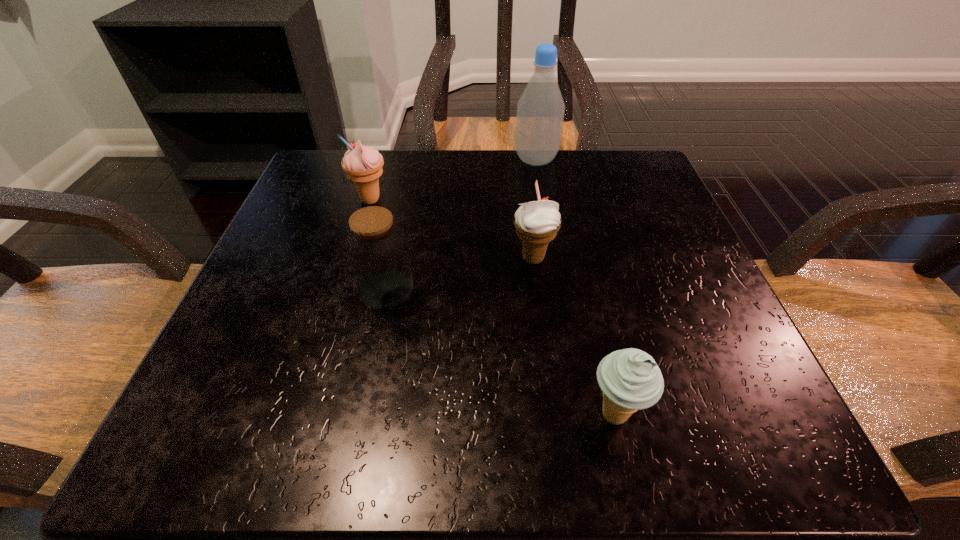
This screenshot has height=540, width=960. I want to click on the farthest object, so click(540, 110).

At what (x,y) coordinates should I click in order to perform the action: click on bottle. Please return your answer as a coordinate pair (x, y). The width and height of the screenshot is (960, 540). Looking at the image, I should click on (540, 110).

At what (x,y) coordinates should I click in order to perform the action: click on the second farthest object. Please return your answer as a coordinate pair (x, y). Looking at the image, I should click on (363, 165).

Locate an element on the screen. The width and height of the screenshot is (960, 540). the leftmost icecream is located at coordinates (363, 165).

You are a GUI agent. You are given a task and a screenshot of the screen. Output one action in this format:
    pyautogui.click(x=<x>, y=<y>)
    Task: Click on the jar
    This screenshot has height=540, width=960.
    Given the screenshot: What is the action you would take?
    pyautogui.click(x=376, y=247)

Where is `the second nearest icecream`? This screenshot has height=540, width=960. the second nearest icecream is located at coordinates (537, 222).

At what (x,y) coordinates should I click in order to perform the action: click on the rightmost icecream. Please return your answer as a coordinate pair (x, y). Image resolution: width=960 pixels, height=540 pixels. Looking at the image, I should click on (630, 379).

The width and height of the screenshot is (960, 540). Identify the location of the nearest object. (630, 379).

Identify the location of free space located on the left of the farthest object. (352, 160).

In order to click on free space located 0.070m on the back of the fourth nearest object in this screenshot , I will do `click(379, 171)`.